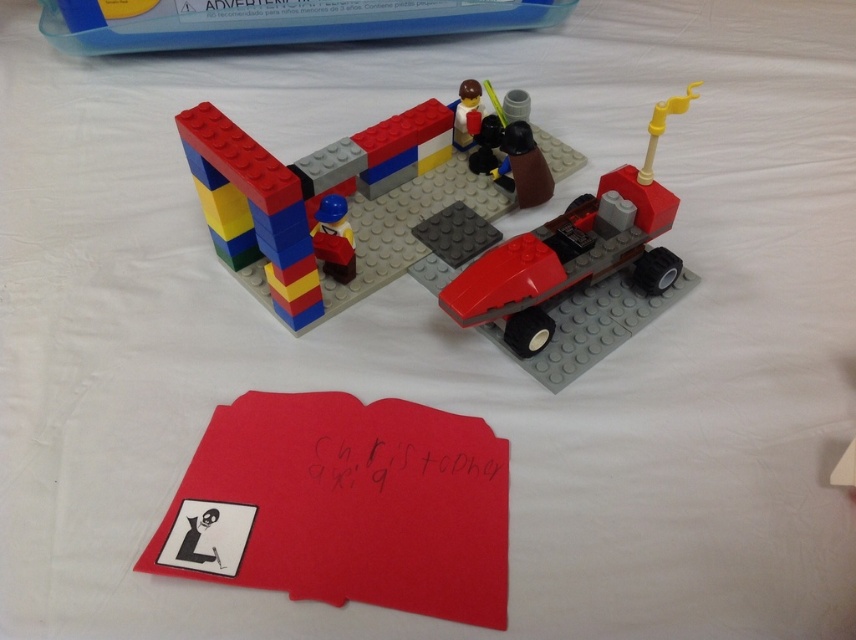
You are a photographer trying to capture the LEGO car and pit stop area. You notice two points in the scene at coordinates point (x=544, y=378) and point (x=385, y=17). Which point is closer to your camera lens?

Point (x=544, y=378) is closer to the camera than point (x=385, y=17).